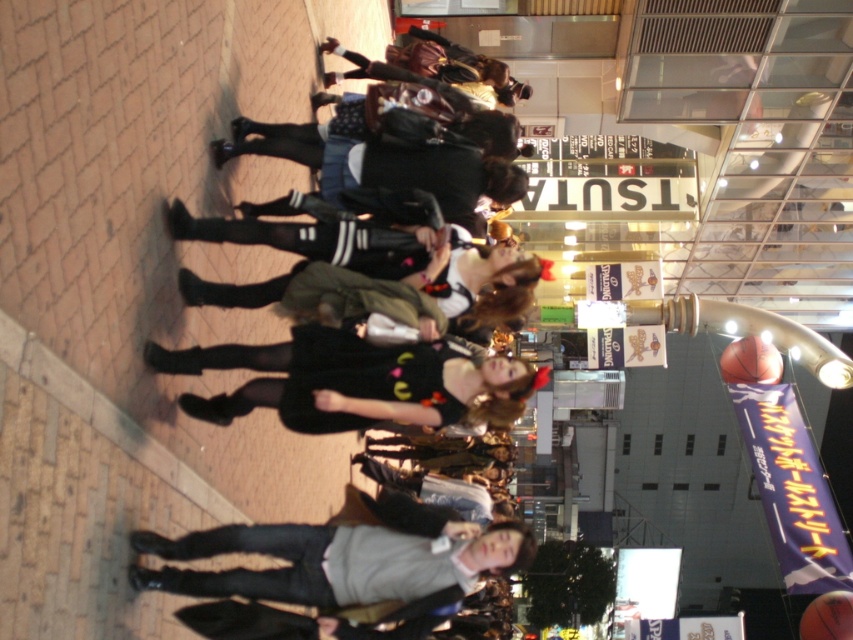
You are a photographer trying to capture both the black leather jacket at center and the rubber textured basketball at right in a single frame. Considering their sizes, which object will appear bigger in the photo?

The black leather jacket at center will appear bigger in the photo because it is larger in size than the rubber textured basketball at right.

From the picture: You are a delivery person who needs to place both the rubber textured basketball at right and the orange textured basketball at center into a storage box. The box can only hold items with a maximum width of 30 cm. Which basketball should you place first to ensure both fit?

The orange textured basketball at center has a smaller width than the rubber textured basketball at right. Place the rubber textured basketball at right first, then the orange textured basketball at center to ensure both fit within the box.

You are standing at the point marked by coordinates point (376,227) in the image. What object are you directly facing?

You are directly facing the black leather jacket at center, which is represented by point (376,227).